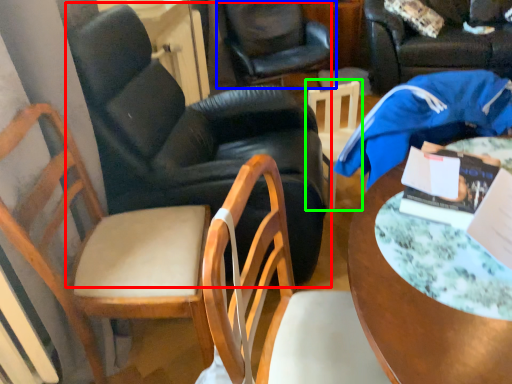
Question: Which object is the closest to the chair (highlighted by a red box)? Choose among these: chair (highlighted by a blue box) or chair (highlighted by a green box).

Choices:
 (A) chair
 (B) chair

Answer: (B)